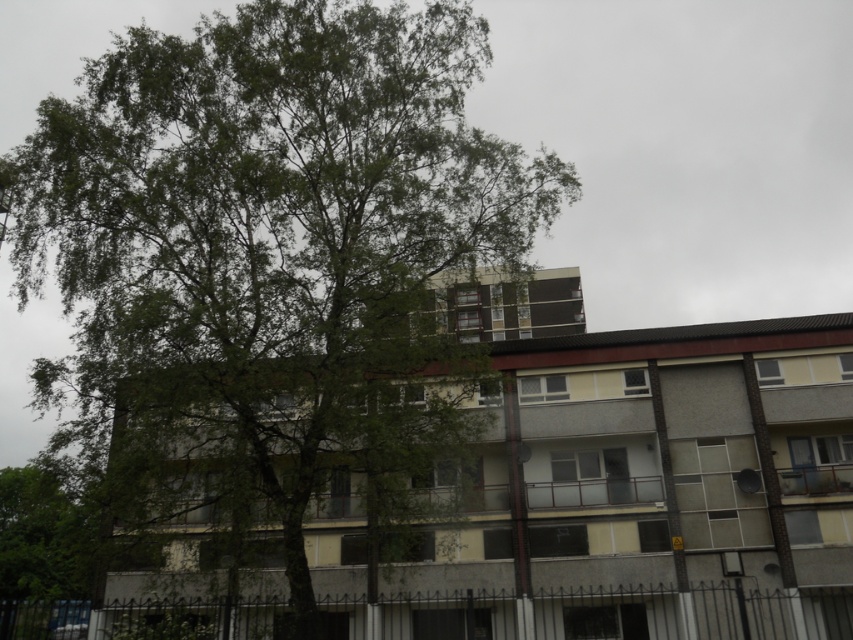
Question: Is green leafy tree at center bigger than green leafy tree at lower left?

Choices:
 (A) no
 (B) yes

Answer: (B)

Question: Does green leafy tree at center have a larger size compared to green leafy tree at lower left?

Choices:
 (A) yes
 (B) no

Answer: (A)

Question: Observing the image, what is the correct spatial positioning of green leafy tree at center in reference to green leafy tree at lower left?

Choices:
 (A) below
 (B) above

Answer: (B)

Question: Among these points, which one is nearest to the camera?

Choices:
 (A) (88, 529)
 (B) (219, 189)

Answer: (B)

Question: Which point is farther from the camera taking this photo?

Choices:
 (A) (73, 518)
 (B) (424, 35)

Answer: (A)